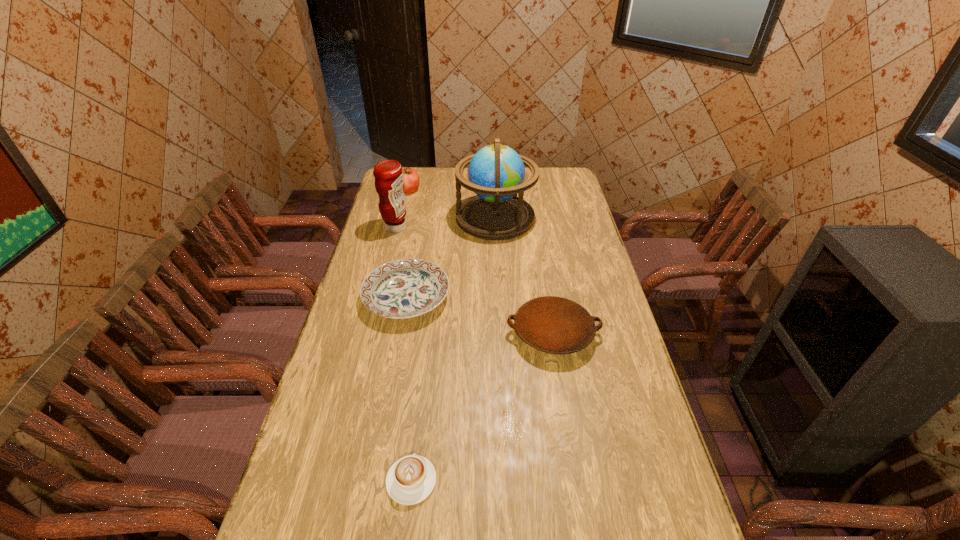
Identify the location of the tallest object. Image resolution: width=960 pixels, height=540 pixels. (496, 173).

Locate an element on the screen. This screenshot has height=540, width=960. condiment is located at coordinates (388, 175).

I want to click on the farthest object, so click(x=411, y=181).

Locate an element on the screen. This screenshot has height=540, width=960. the fourth shortest object is located at coordinates (411, 181).

I want to click on the right plate, so click(x=555, y=325).

At what (x,y) coordinates should I click in order to perform the action: click on the taller plate. Please return your answer as a coordinate pair (x, y). The image size is (960, 540). Looking at the image, I should click on (555, 325).

This screenshot has width=960, height=540. I want to click on the shorter plate, so click(405, 288).

At what (x,y) coordinates should I click in order to perform the action: click on the nearest object. Please return your answer as a coordinate pair (x, y). Looking at the image, I should click on (411, 479).

Image resolution: width=960 pixels, height=540 pixels. What are the coordinates of `vacant space located 0.190m on the back of the tallest object` in the screenshot? It's located at pyautogui.click(x=493, y=178).

Image resolution: width=960 pixels, height=540 pixels. What are the coordinates of `free spot located 0.170m on the right of the second tallest object` in the screenshot? It's located at (448, 228).